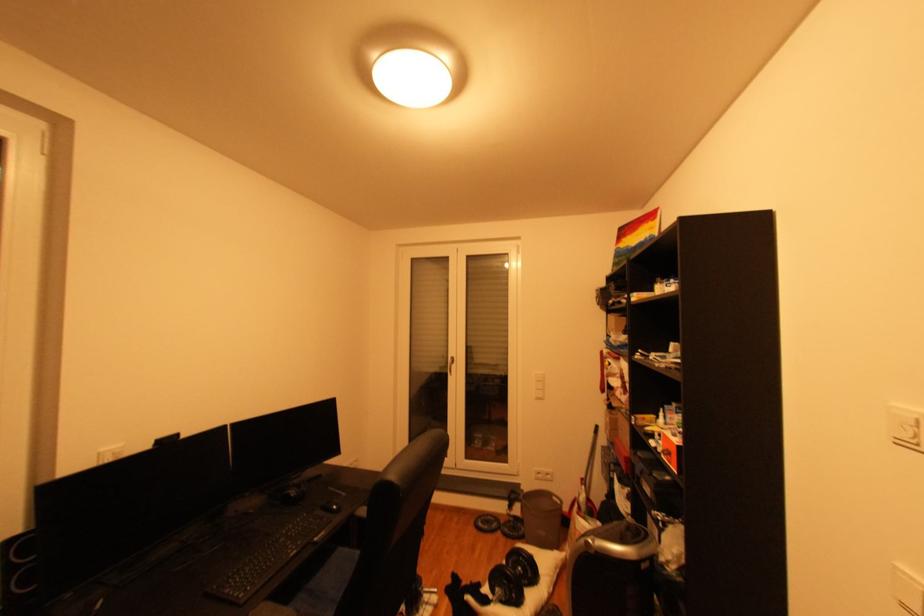
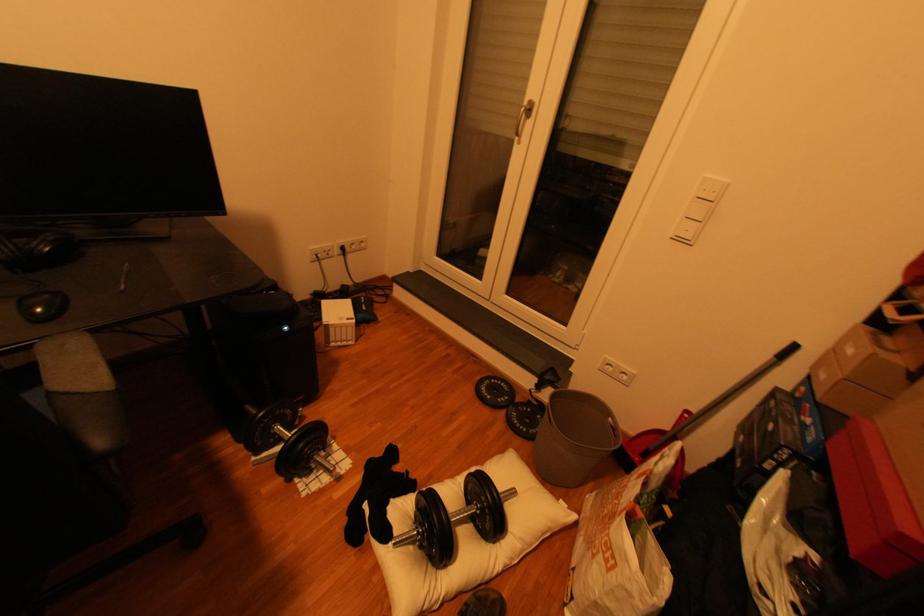
Locate, in the second image, the point that corresponds to point 345,508 in the first image.

(47, 310)